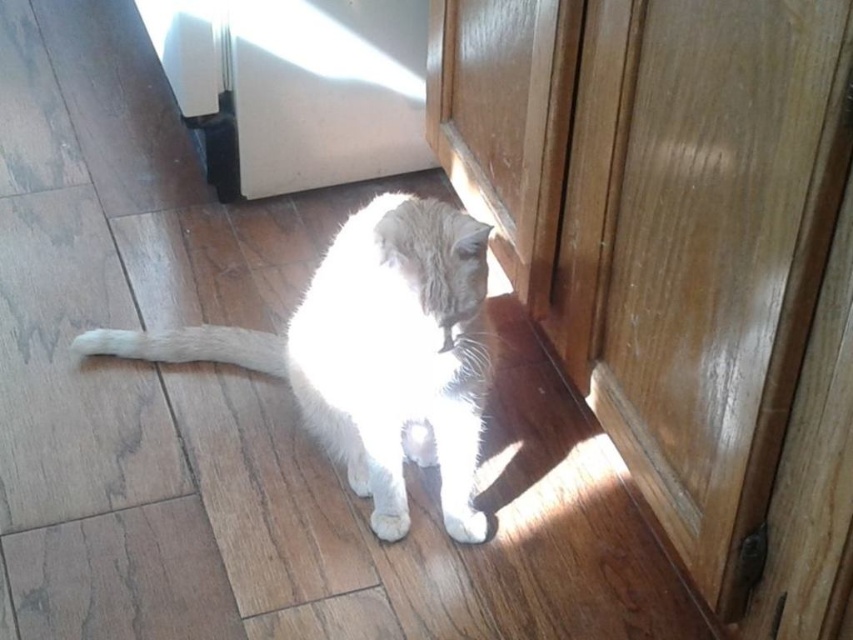
Is point (207, 353) farther from viewer compared to point (445, 525)?

Yes, point (207, 353) is behind point (445, 525).

Who is higher up, white fluffy tail at lower left or white fluffy paw at lower center?

white fluffy tail at lower left is higher up.

Locate an element on the screen. Image resolution: width=853 pixels, height=640 pixels. white fluffy tail at lower left is located at coordinates 190,346.

Is white fluffy cat at center wider than white fur paw at lower center?

Correct, the width of white fluffy cat at center exceeds that of white fur paw at lower center.

Is white fluffy cat at center bigger than white fur paw at lower center?

Indeed, white fluffy cat at center has a larger size compared to white fur paw at lower center.

Which is behind, point (328, 451) or point (387, 534)?

Positioned behind is point (328, 451).

The width and height of the screenshot is (853, 640). In order to click on white fluffy cat at center in this screenshot , I will do `click(370, 346)`.

Can you confirm if white fluffy tail at lower left is smaller than white fur paw at lower center?

No.

Who is shorter, white fluffy tail at lower left or white fur paw at lower center?

With less height is white fur paw at lower center.

Between point (137, 349) and point (399, 536), which one is positioned in front?

Point (399, 536) is in front.

You are a GUI agent. You are given a task and a screenshot of the screen. Output one action in this format:
    pyautogui.click(x=<x>, y=<y>)
    Task: Click on the white fluffy tail at lower left
    This screenshot has width=853, height=640.
    Given the screenshot: What is the action you would take?
    pyautogui.click(x=190, y=346)